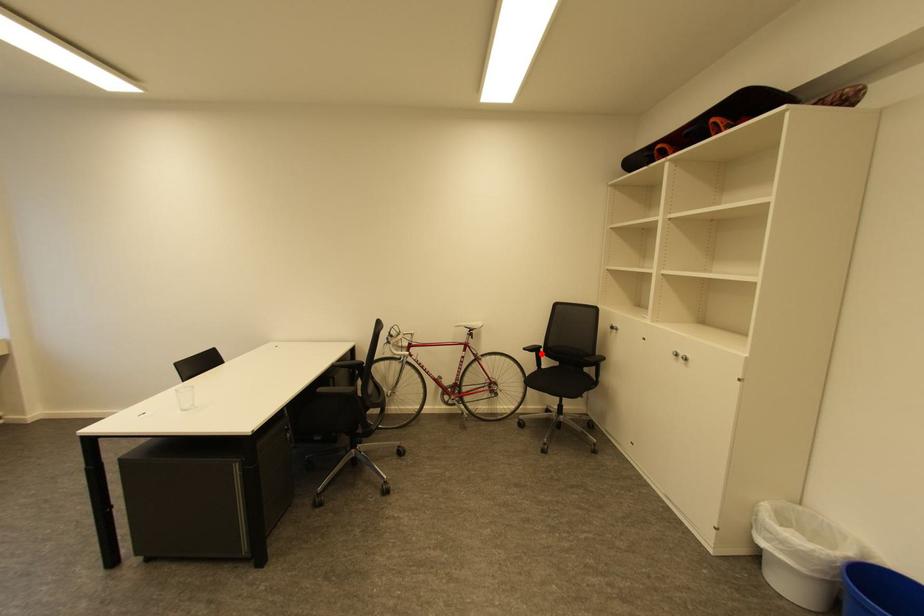
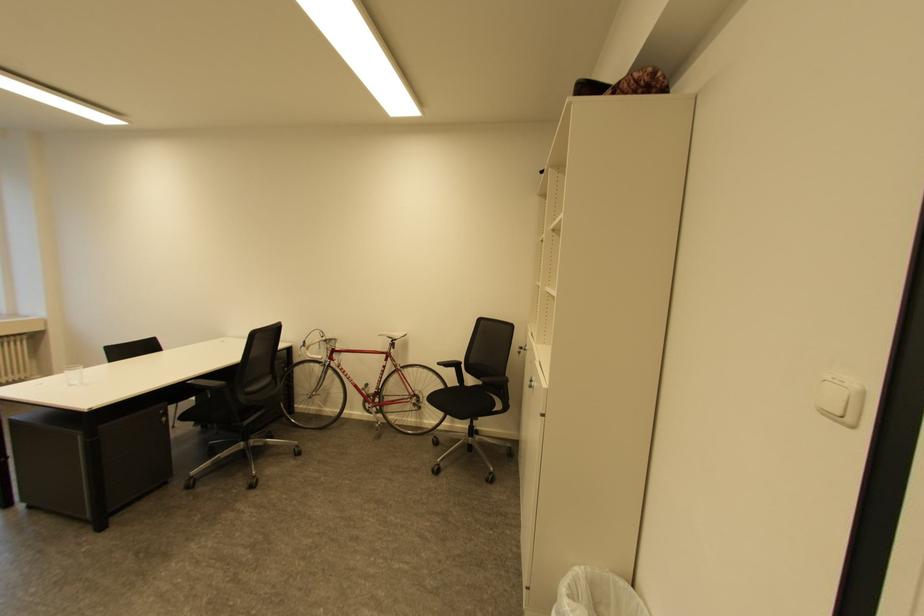
Find the pixel in the second image that matches the highlighted location in the first image.

(459, 370)